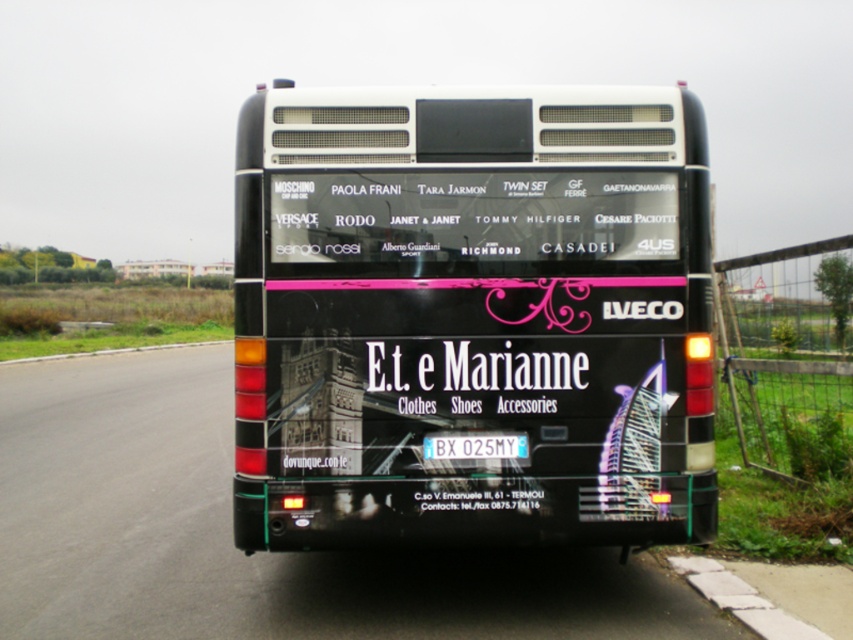
Based on the photo, which is more to the left, black glossy bus at center or blue metallic license plate at center?

From the viewer's perspective, black glossy bus at center appears more on the left side.

Which is above, black glossy bus at center or blue metallic license plate at center?

Positioned higher is black glossy bus at center.

The width and height of the screenshot is (853, 640). What are the coordinates of `black glossy bus at center` in the screenshot? It's located at (473, 316).